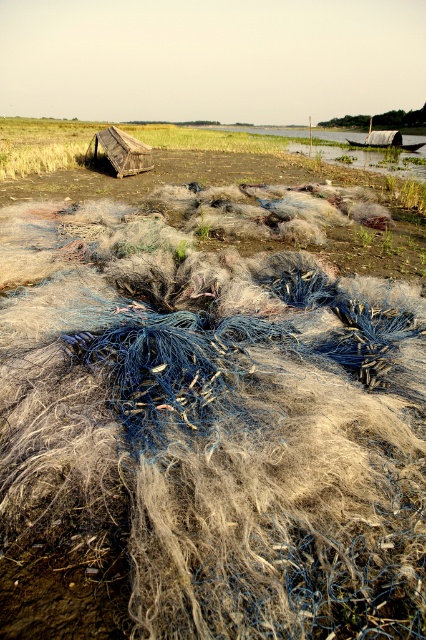
From the picture: You are a fisherman who wants to store your fishing gear. You have a fuzzy blue net at center and a rustic wooden hut at center in view. Which object is narrower so you can decide where to place your gear?

The fuzzy blue net at center has a lesser width compared to rustic wooden hut at center, so it is narrower.